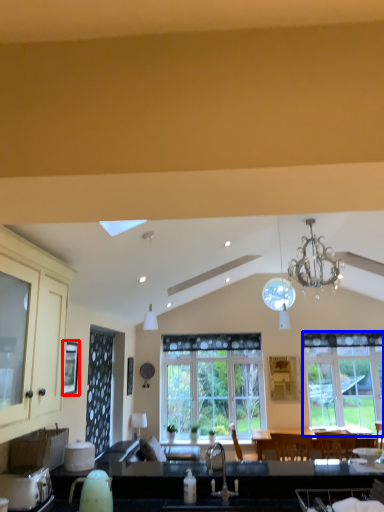
Question: Which object is closer to the camera taking this photo, window screen (highlighted by a red box) or window (highlighted by a blue box)?

Choices:
 (A) window screen
 (B) window

Answer: (A)